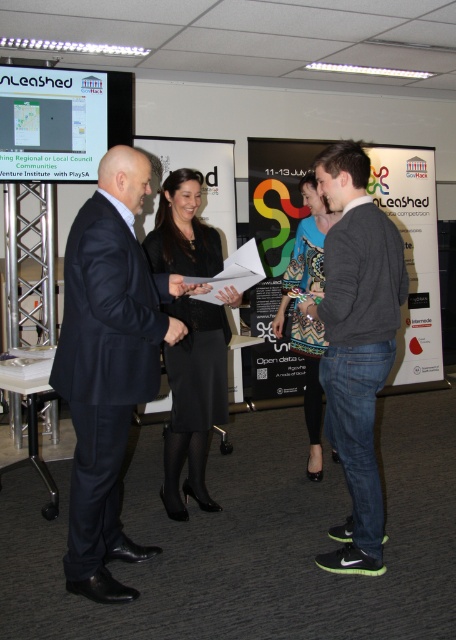
Is dark gray sweater at center to the right of printed fabric dress at center from the viewer's perspective?

Yes, dark gray sweater at center is to the right of printed fabric dress at center.

The width and height of the screenshot is (456, 640). What do you see at coordinates (357, 342) in the screenshot? I see `dark gray sweater at center` at bounding box center [357, 342].

The width and height of the screenshot is (456, 640). Describe the element at coordinates (357, 342) in the screenshot. I see `dark gray sweater at center` at that location.

You are a GUI agent. You are given a task and a screenshot of the screen. Output one action in this format:
    pyautogui.click(x=<x>, y=<y>)
    Task: Click on the dark gray sweater at center
    
    Given the screenshot: What is the action you would take?
    pyautogui.click(x=357, y=342)

Who is more distant from viewer, (65, 573) or (182, 317)?

Point (182, 317)

Can you confirm if dark blue suit at center is positioned below black satin skirt at center?

Correct, dark blue suit at center is located below black satin skirt at center.

In order to click on dark blue suit at center in this screenshot , I will do `click(108, 364)`.

Which is in front, point (114, 230) or point (82, 156)?

Point (114, 230) is more forward.

Does dark blue suit at center appear over matte black screen at upper left?

No, dark blue suit at center is not above matte black screen at upper left.

Who is more forward, (108, 518) or (71, 120)?

Point (108, 518) is more forward.

Where is `dark blue suit at center`? This screenshot has width=456, height=640. dark blue suit at center is located at coordinates (108, 364).